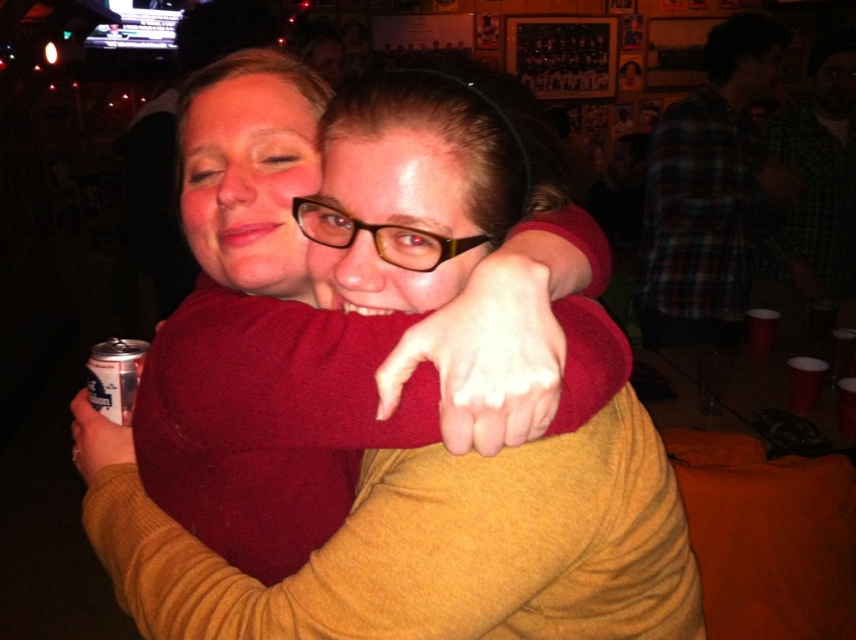
Is matte red sweater at center thinner than silver metallic can at lower left?

In fact, matte red sweater at center might be wider than silver metallic can at lower left.

Looking at this image, does matte red sweater at center appear on the right side of silver metallic can at lower left?

Correct, you'll find matte red sweater at center to the right of silver metallic can at lower left.

Is point (438, 608) closer to camera compared to point (100, 381)?

Yes, it is in front of point (100, 381).

Where is `matte red sweater at center`? The width and height of the screenshot is (856, 640). matte red sweater at center is located at coordinates (431, 545).